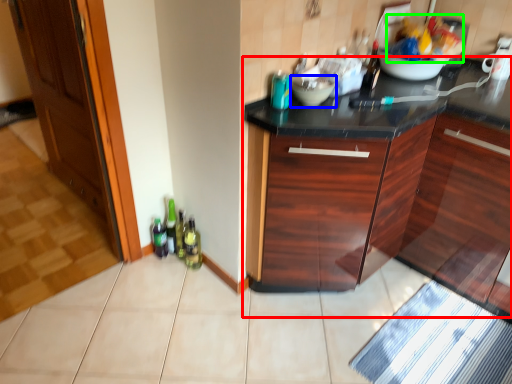
Question: Which object is positioned farthest from cabinetry (highlighted by a red box)? Select from mixing bowl (highlighted by a blue box) and food (highlighted by a green box).

Choices:
 (A) mixing bowl
 (B) food

Answer: (A)